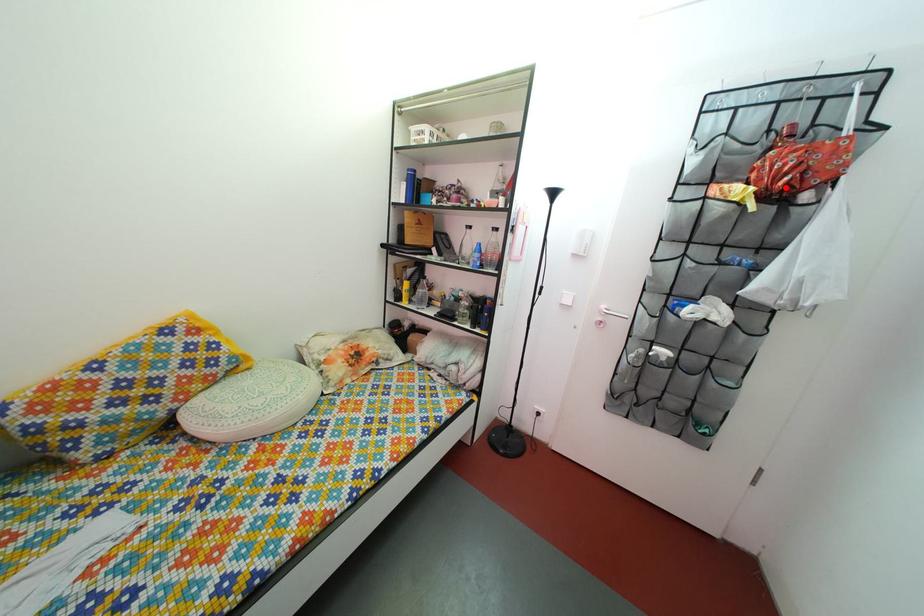
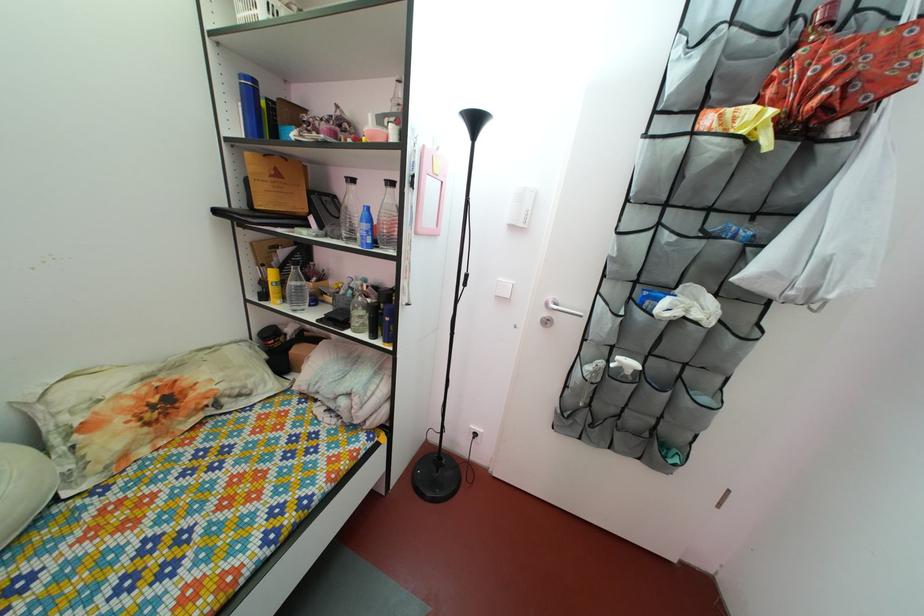
Locate, in the second image, the point that corresponds to the highlighted location in the first image.

(816, 103)